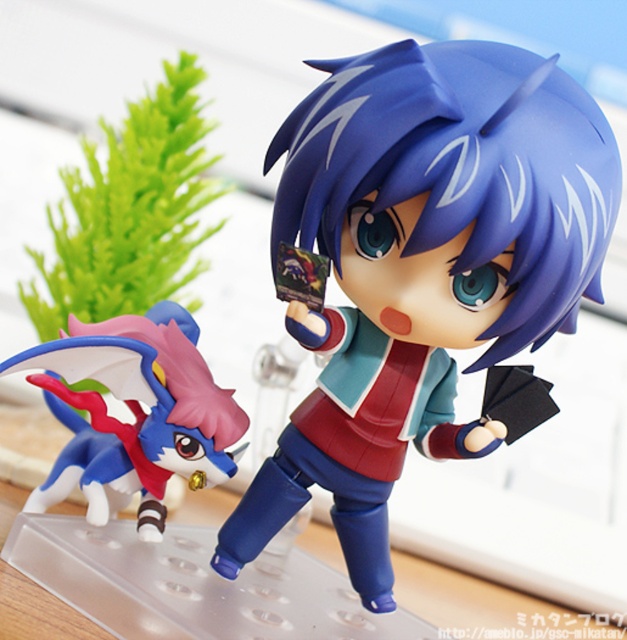
Question: Can you confirm if matte plastic doll at center is wider than shiny blue and white plush toy at lower left?

Choices:
 (A) no
 (B) yes

Answer: (B)

Question: Which point is farther to the camera?

Choices:
 (A) matte plastic doll at center
 (B) shiny blue and white plush toy at lower left

Answer: (B)

Question: Can you confirm if matte plastic doll at center is positioned to the left of shiny blue and white plush toy at lower left?

Choices:
 (A) no
 (B) yes

Answer: (A)

Question: Which of the following is the farthest from the observer?

Choices:
 (A) shiny blue and white plush toy at lower left
 (B) matte plastic doll at center

Answer: (A)

Question: Is matte plastic doll at center closer to camera compared to shiny blue and white plush toy at lower left?

Choices:
 (A) yes
 (B) no

Answer: (A)